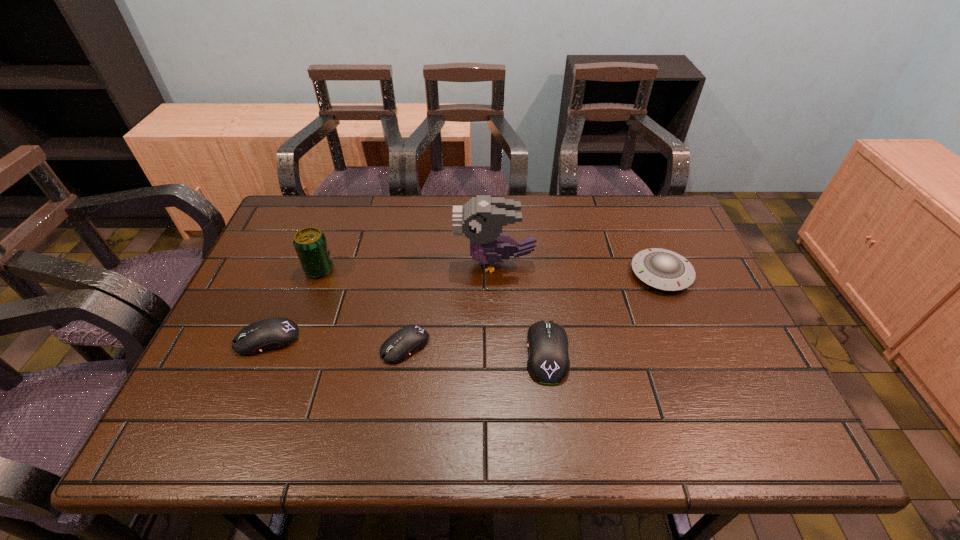
The image size is (960, 540). What are the coordinates of `vacant area that lies between the saucer and the bird` in the screenshot? It's located at (578, 268).

Find the location of a particular element. free spot between the shortest computer equipment and the bird is located at coordinates (450, 305).

This screenshot has height=540, width=960. Identify the location of vacant region between the saucer and the rightmost computer equipment. (604, 313).

Find the location of a particular element. free spot between the rightmost computer equipment and the third object from left to right is located at coordinates (476, 349).

Identify which object is located as the third nearest to the rightmost object. Please provide its 2D coordinates. Your answer should be formatted as a tuple, i.e. [(x, y)], where the tuple contains the x and y coordinates of a point satisfying the conditions above.

[(399, 346)]

The image size is (960, 540). I want to click on the closest object relative to the second shortest computer equipment, so click(310, 243).

Locate an element on the screen. The height and width of the screenshot is (540, 960). computer equipment that is the nearest to the bird is located at coordinates (548, 362).

Where is `the closest computer equipment relative to the rightmost computer equipment`? the closest computer equipment relative to the rightmost computer equipment is located at coordinates (399, 346).

Identify the location of free region that satisfies the following two spatial constraints: 1. on the front side of the shortest object; 2. on the right side of the rightmost computer equipment. This screenshot has height=540, width=960. click(x=404, y=353).

Image resolution: width=960 pixels, height=540 pixels. Find the location of `free space that satisfies the following two spatial constraints: 1. at the beak of the bird; 2. on the left side of the rightmost object`. free space that satisfies the following two spatial constraints: 1. at the beak of the bird; 2. on the left side of the rightmost object is located at coordinates (495, 274).